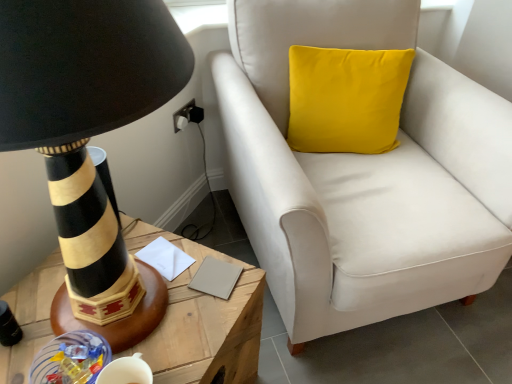
This screenshot has height=384, width=512. I want to click on blank space above wooden table at left (from a real-world perspective), so click(x=152, y=314).